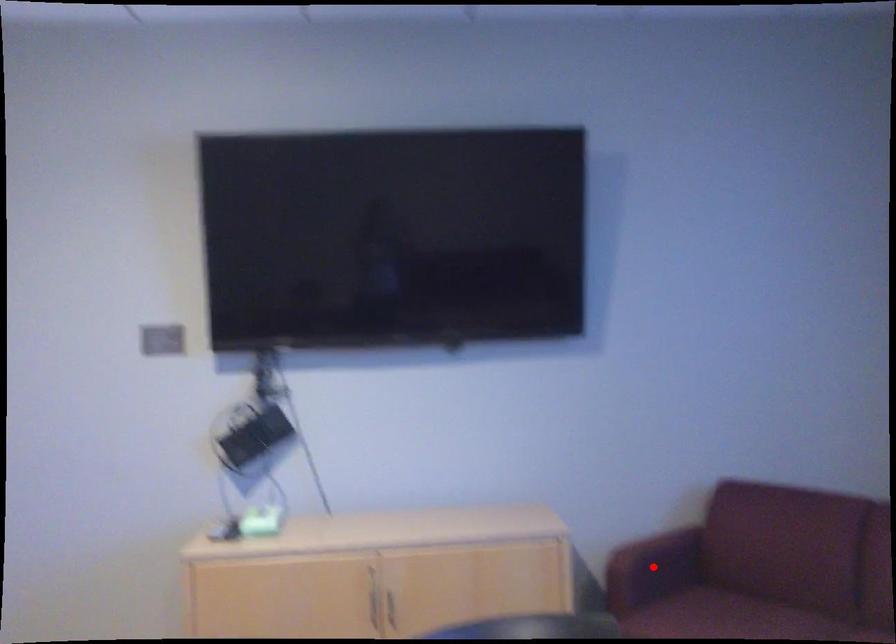
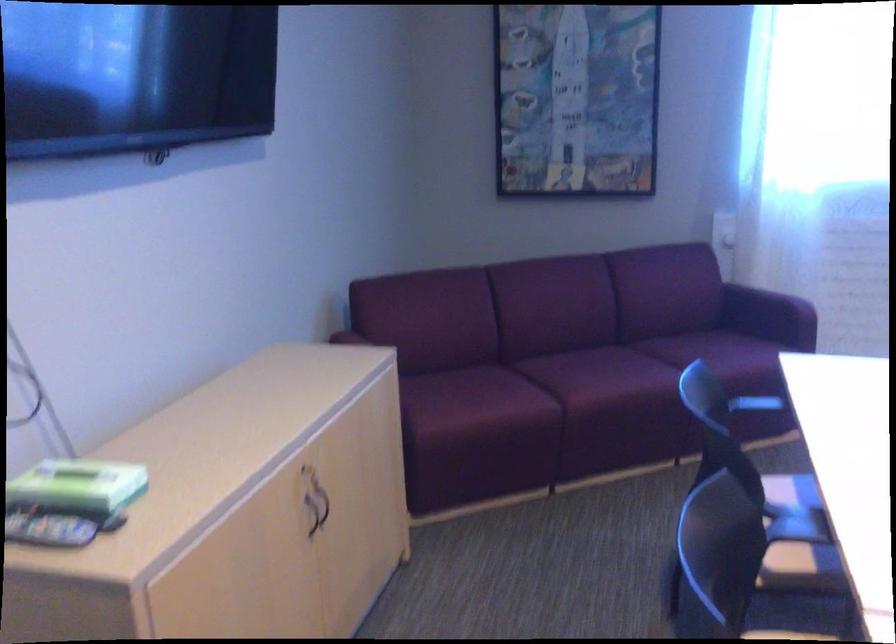
Question: I am providing you with two images of the same scene from different viewpoints. A red point is marked on the first image. Is the red point's position out of view in image 2?

Choices:
 (A) Yes
 (B) No

Answer: (A)